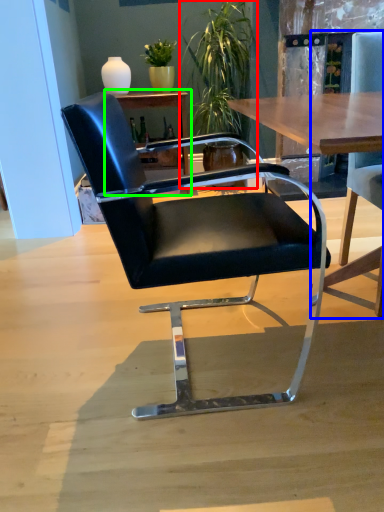
Question: Estimate the real-world distances between objects in this image. Which object is farther from houseplant (highlighted by a red box), chair (highlighted by a blue box) or table (highlighted by a green box)?

Choices:
 (A) chair
 (B) table

Answer: (A)